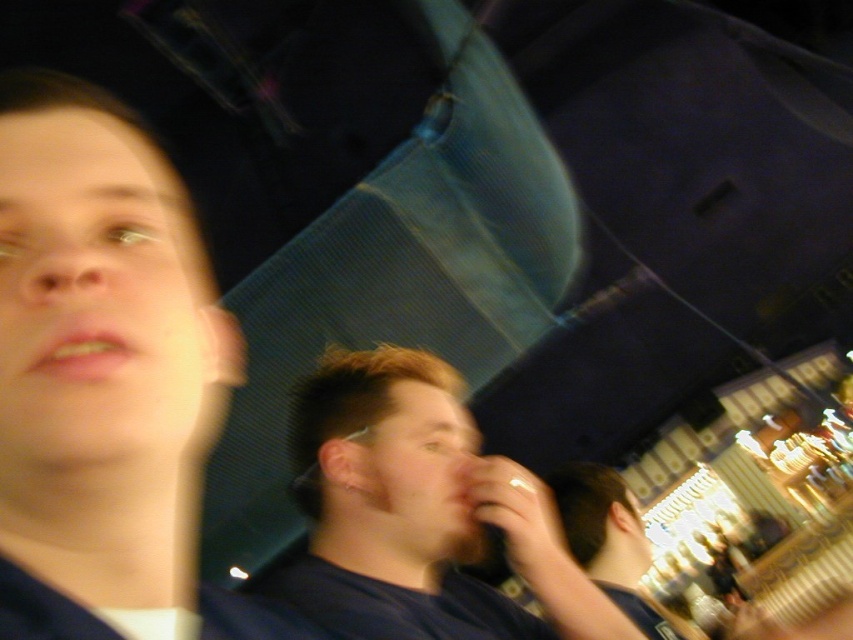
Who is more distant from viewer, (148, 627) or (578, 548)?

Positioned behind is point (578, 548).

Who is shorter, smooth skin face at upper left or dark blue shirt at center?

With less height is dark blue shirt at center.

Which is behind, point (61, 506) or point (606, 577)?

The point (606, 577) is more distant.

Locate an element on the screen. This screenshot has width=853, height=640. smooth skin face at upper left is located at coordinates (99, 369).

Can you confirm if dark blue t-shirt at center is wider than dark blue shirt at center?

Yes.

Between dark blue t-shirt at center and dark blue shirt at center, which one has more height?

dark blue t-shirt at center is taller.

Who is more forward, (540,563) or (561,484)?

Positioned in front is point (540,563).

You are a GUI agent. You are given a task and a screenshot of the screen. Output one action in this format:
    pyautogui.click(x=<x>, y=<y>)
    Task: Click on the dark blue t-shirt at center
    
    Given the screenshot: What is the action you would take?
    pyautogui.click(x=421, y=513)

Is smooth skin face at upper left taller than dark blue t-shirt at center?

Correct, smooth skin face at upper left is much taller as dark blue t-shirt at center.

You are a GUI agent. You are given a task and a screenshot of the screen. Output one action in this format:
    pyautogui.click(x=<x>, y=<y>)
    Task: Click on the smooth skin face at upper left
    
    Given the screenshot: What is the action you would take?
    pyautogui.click(x=99, y=369)

Locate an element on the screen. The image size is (853, 640). smooth skin face at upper left is located at coordinates (99, 369).

Locate an element on the screen. smooth skin face at upper left is located at coordinates (99, 369).